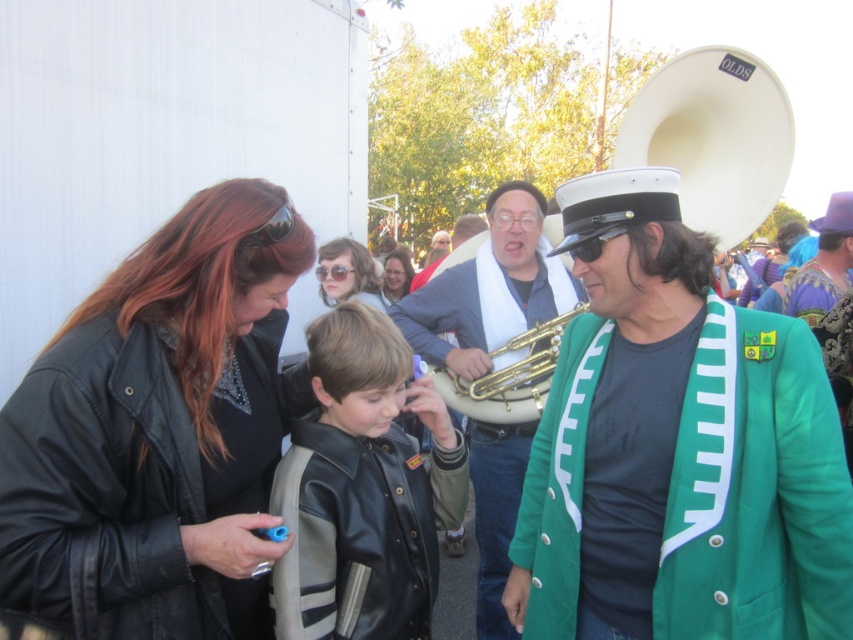
Describe the element at coordinates (677, 449) in the screenshot. The width and height of the screenshot is (853, 640). I see `green woolen blazer at right` at that location.

Is green woolen blazer at right behind leather jacket at left?

Yes, it is.

Find the location of a particular element. The image size is (853, 640). green woolen blazer at right is located at coordinates (677, 449).

The height and width of the screenshot is (640, 853). Find the location of `black leather jacket at center`. black leather jacket at center is located at coordinates (363, 490).

Can you confirm if gold brass tuba at center is smaller than clear plastic goggles at center?

No.

Can you confirm if gold brass tuba at center is shorter than clear plastic goggles at center?

No.

Between point (560, 301) and point (315, 272), which one is positioned behind?

Positioned behind is point (315, 272).

Find the location of `gold brass tuba at center`. gold brass tuba at center is located at coordinates (490, 289).